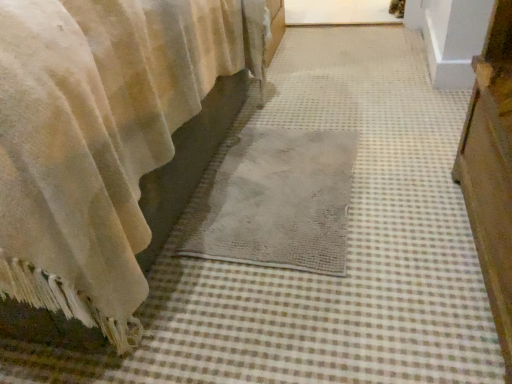
Question: Is gray woven mat at center to the left of velvet beige curtain at lower left from the viewer's perspective?

Choices:
 (A) no
 (B) yes

Answer: (A)

Question: From the image's perspective, is gray woven mat at center on velvet beige curtain at lower left?

Choices:
 (A) no
 (B) yes

Answer: (A)

Question: Does gray woven mat at center have a greater height compared to velvet beige curtain at lower left?

Choices:
 (A) yes
 (B) no

Answer: (B)

Question: Can velvet beige curtain at lower left be found inside gray woven mat at center?

Choices:
 (A) no
 (B) yes

Answer: (A)

Question: Does gray woven mat at center lie behind velvet beige curtain at lower left?

Choices:
 (A) no
 (B) yes

Answer: (B)

Question: Does gray woven mat at center turn towards velvet beige curtain at lower left?

Choices:
 (A) yes
 (B) no

Answer: (B)

Question: Does velvet beige curtain at lower left have a greater height compared to gray woven mat at center?

Choices:
 (A) no
 (B) yes

Answer: (B)

Question: Is velvet beige curtain at lower left at the right side of gray woven mat at center?

Choices:
 (A) yes
 (B) no

Answer: (B)

Question: Is velvet beige curtain at lower left turned away from gray woven mat at center?

Choices:
 (A) no
 (B) yes

Answer: (A)

Question: Is velvet beige curtain at lower left wider than gray woven mat at center?

Choices:
 (A) yes
 (B) no

Answer: (A)

Question: Are velvet beige curtain at lower left and gray woven mat at center making contact?

Choices:
 (A) no
 (B) yes

Answer: (A)

Question: From the image's perspective, would you say velvet beige curtain at lower left is shown under gray woven mat at center?

Choices:
 (A) yes
 (B) no

Answer: (B)

Question: From a real-world perspective, is gray woven mat at center positioned above or below velvet beige curtain at lower left?

Choices:
 (A) below
 (B) above

Answer: (A)